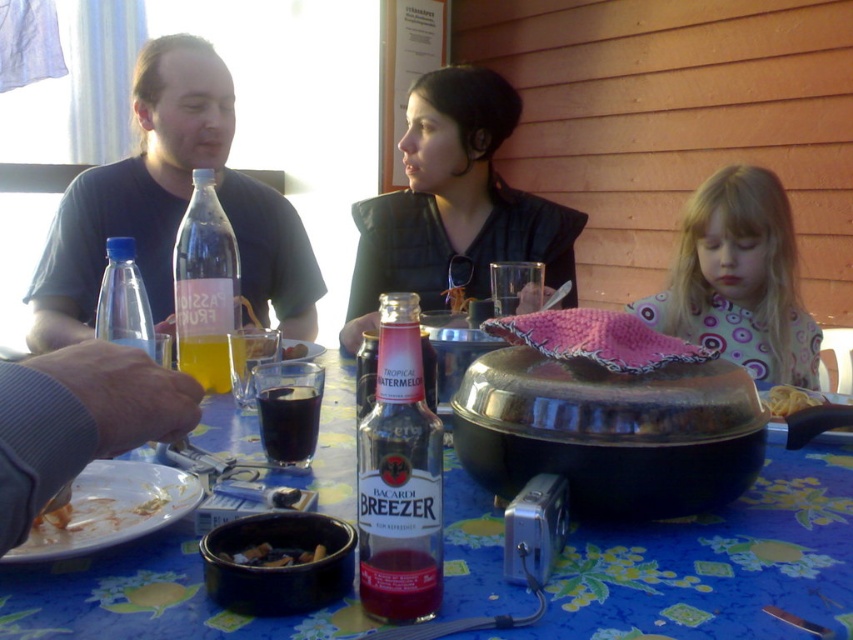
Does blue fabric tablecloth at center have a greater width compared to pink fabric at center?

Correct, the width of blue fabric tablecloth at center exceeds that of pink fabric at center.

Is blue fabric tablecloth at center shorter than pink fabric at center?

Correct, blue fabric tablecloth at center is not as tall as pink fabric at center.

Who is more forward, (x=328, y=627) or (x=733, y=285)?

Point (x=328, y=627)

Identify the location of blue fabric tablecloth at center. (715, 563).

Is matte black shirt at left shorter than gray fabric hand at lower left?

No, matte black shirt at left is not shorter than gray fabric hand at lower left.

Who is more forward, (x=167, y=113) or (x=44, y=413)?

Point (x=44, y=413) is more forward.

Who is more forward, (189,102) or (155,388)?

Positioned in front is point (155,388).

The image size is (853, 640). I want to click on matte black shirt at left, so click(172, 209).

Does matte black shirt at left appear on the right side of white glossy plate at lower left?

Incorrect, matte black shirt at left is not on the right side of white glossy plate at lower left.

Does matte black shirt at left have a smaller size compared to white glossy plate at lower left?

No, matte black shirt at left is not smaller than white glossy plate at lower left.

The height and width of the screenshot is (640, 853). Identify the location of matte black shirt at left. (172, 209).